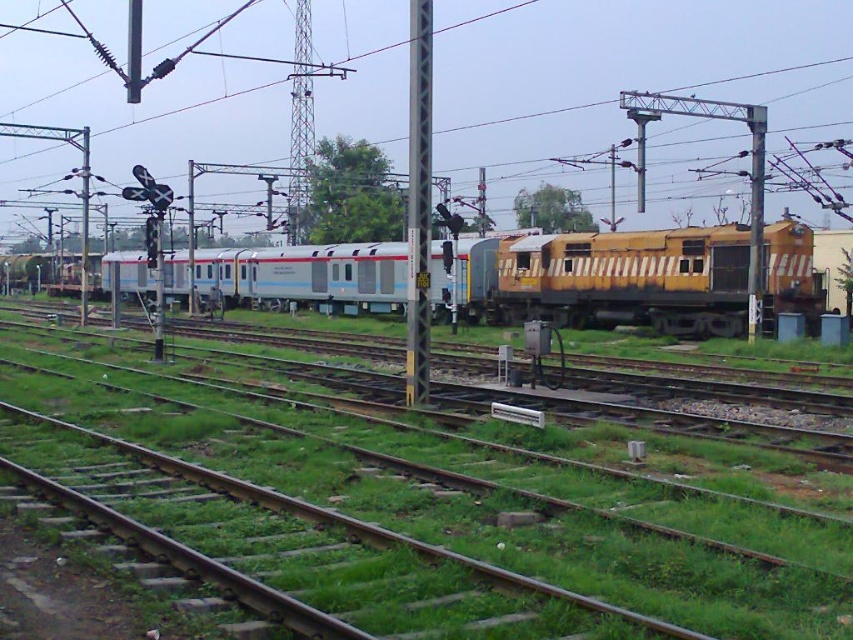
Question: Which of the following is the closest to the observer?

Choices:
 (A) (254, 262)
 (B) (766, 612)
 (C) (757, 124)

Answer: (B)

Question: Which point is closer to the camera?

Choices:
 (A) metallic gray pole at center
 (B) metallic pole at center
 (C) yellow matte train at center
 (D) green grass at center

Answer: (D)

Question: Can you confirm if yellow matte train at center is positioned below metallic gray pole at center?

Choices:
 (A) no
 (B) yes

Answer: (B)

Question: Is yellow matte train at center below metallic pole at center?

Choices:
 (A) yes
 (B) no

Answer: (A)

Question: Which object appears farthest from the camera in this image?

Choices:
 (A) yellow matte train at center
 (B) metallic pole at center
 (C) metallic gray pole at center
 (D) green grass at center

Answer: (A)

Question: Can you confirm if green grass at center is bigger than metallic pole at center?

Choices:
 (A) yes
 (B) no

Answer: (B)